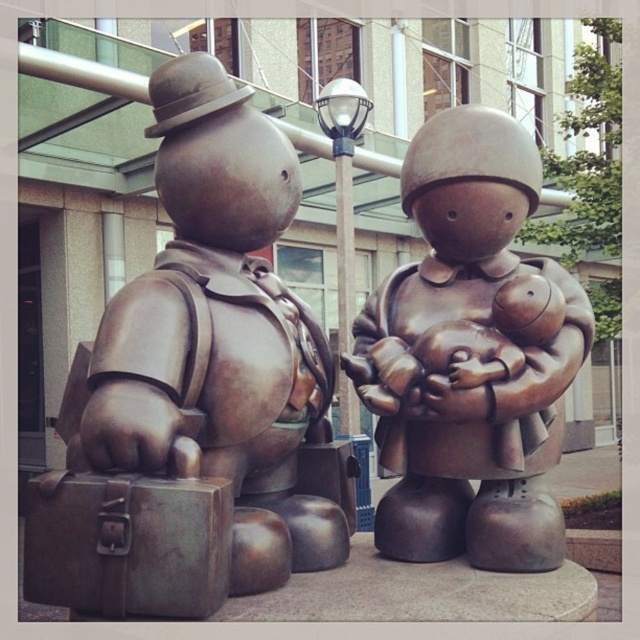
Question: Is bronze statue at center positioned at the back of bronze suitcase at lower left?

Choices:
 (A) yes
 (B) no

Answer: (A)

Question: Among these points, which one is nearest to the camera?

Choices:
 (A) (160, 442)
 (B) (60, 596)

Answer: (A)

Question: Which is nearer to the brushed metal briefcase at left?

Choices:
 (A) bronze suitcase at lower left
 (B) bronze statue at center

Answer: (A)

Question: Is the position of brushed metal briefcase at left less distant than that of bronze suitcase at lower left?

Choices:
 (A) yes
 (B) no

Answer: (B)

Question: Which of these objects is positioned closest to the bronze statue at center?

Choices:
 (A) brushed metal briefcase at left
 (B) bronze suitcase at lower left

Answer: (A)

Question: Is brushed metal briefcase at left positioned before bronze suitcase at lower left?

Choices:
 (A) yes
 (B) no

Answer: (B)